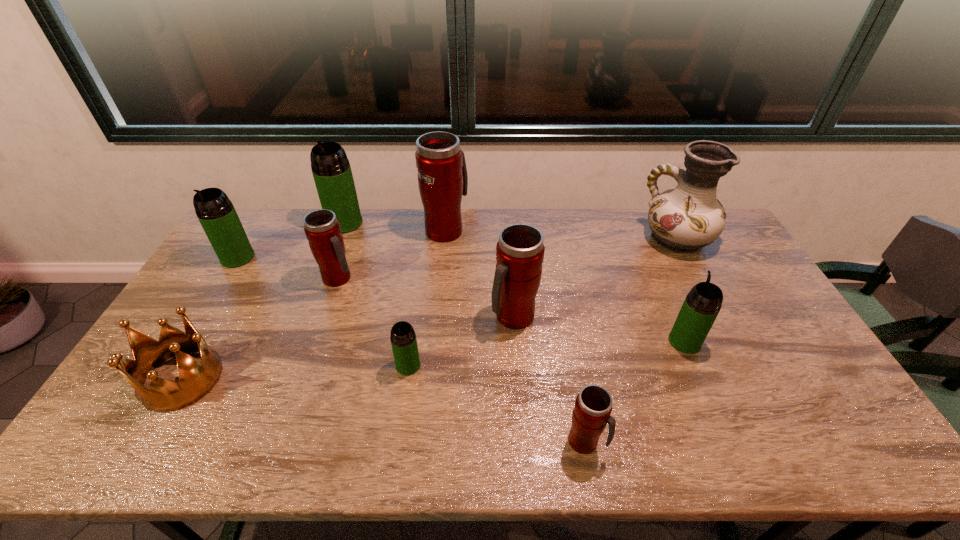
The height and width of the screenshot is (540, 960). Find the location of `the rightmost green thermos bottle`. the rightmost green thermos bottle is located at coordinates (702, 304).

Find the location of a particular element. The width and height of the screenshot is (960, 540). the third nearest red thermos bottle is located at coordinates (322, 229).

Locate an element on the screen. This screenshot has width=960, height=540. the third biggest red thermos bottle is located at coordinates (322, 229).

Image resolution: width=960 pixels, height=540 pixels. Find the location of `crown`. crown is located at coordinates (197, 378).

I want to click on the second nearest thermos bottle, so click(x=403, y=339).

The width and height of the screenshot is (960, 540). What are the coordinates of `the smallest green thermos bottle` in the screenshot? It's located at (403, 339).

The image size is (960, 540). Identify the location of the nearest red thermos bottle. (593, 406).

Identify the location of the nearest object. The width and height of the screenshot is (960, 540). (593, 406).

At what (x,y) coordinates should I click in order to perform the action: click on free space located 0.090m from the spout of the farthest green thermos bottle. Please return your answer as a coordinate pair (x, y). Image resolution: width=960 pixels, height=540 pixels. Looking at the image, I should click on (335, 249).

Where is `vacant space situated on the left of the red vase`? This screenshot has height=540, width=960. vacant space situated on the left of the red vase is located at coordinates (538, 239).